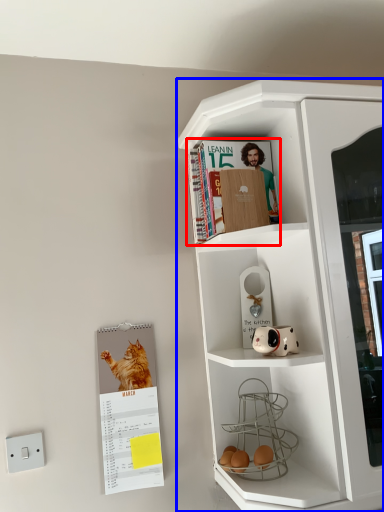
Question: Among these objects, which one is nearest to the camera, magazine (highlighted by a red box) or cupboard (highlighted by a blue box)?

Choices:
 (A) magazine
 (B) cupboard

Answer: (B)